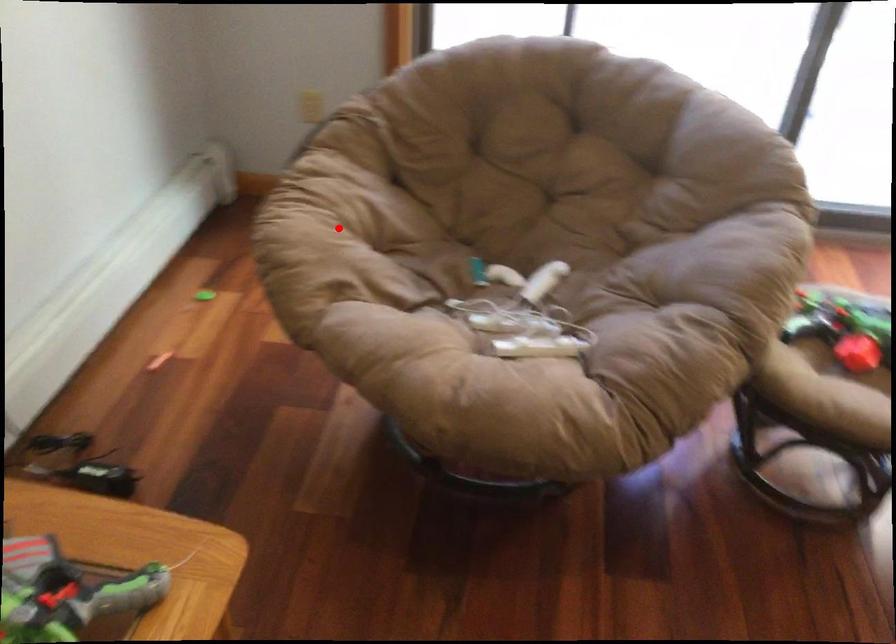
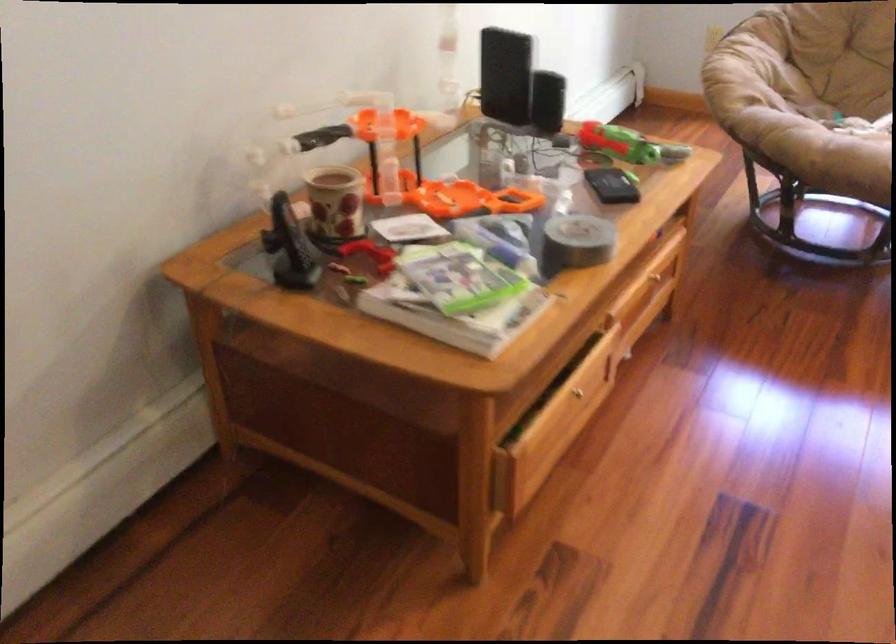
Question: A red point is marked in image1. In image2, is the corresponding 3D point closer to the camera or farther? Reply with the corresponding letter.

Choices:
 (A) The corresponding 3D point is closer.
 (B) The corresponding 3D point is farther.

Answer: (B)